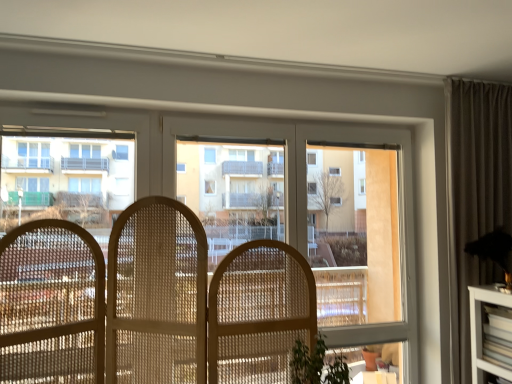
Where is `white glossy building at left`? The image size is (512, 384). white glossy building at left is located at coordinates (66, 179).

Does transparent glass window at center have a larger size compared to transparent glass bay window at center?

Yes.

Is the position of transparent glass window at center more distant than that of transparent glass bay window at center?

That is False.

Is transparent glass bay window at center a part of transparent glass window at center?

Yes.

Which is less distant, (x=285, y=234) or (x=47, y=200)?

Point (x=47, y=200)

Looking at this image, is transparent glass window at center outside of white glossy building at left?

transparent glass window at center is positioned outside white glossy building at left.

From the picture: Who is more distant, transparent glass window at center or white glossy building at left?

white glossy building at left is further from the camera.

Based on the photo, considering the relative sizes of transparent glass window at center and white glossy building at left in the image provided, is transparent glass window at center thinner than white glossy building at left?

Yes.

In terms of width, does transparent glass bay window at center look wider or thinner when compared to white glossy building at left?

Clearly, transparent glass bay window at center has less width compared to white glossy building at left.

Is the depth of transparent glass bay window at center less than that of white glossy building at left?

No, transparent glass bay window at center is behind white glossy building at left.

Is transparent glass bay window at center at the right side of white glossy building at left?

Correct, you'll find transparent glass bay window at center to the right of white glossy building at left.

Is transparent glass bay window at center looking in the opposite direction of white glossy building at left?

No, white glossy building at left is not at the back of transparent glass bay window at center.

From the image's perspective, is transparent glass bay window at center above or below transparent glass window at center?

Clearly, from the image's perspective, transparent glass bay window at center is above transparent glass window at center.

Is transparent glass window at center a part of transparent glass bay window at center?

That's incorrect, transparent glass window at center is not inside transparent glass bay window at center.

Are transparent glass bay window at center and transparent glass window at center located far from each other?

No, transparent glass bay window at center is in close proximity to transparent glass window at center.

From a real-world perspective, is transparent glass bay window at center positioned above or below transparent glass window at center?

From a real-world perspective, transparent glass bay window at center is physically above transparent glass window at center.

From the image's perspective, which is below, white glossy building at left or transparent glass window at center?

transparent glass window at center is shown below in the image.

Does white glossy building at left turn towards transparent glass window at center?

Yes, white glossy building at left is oriented towards transparent glass window at center.

Consider the image. From a real-world perspective, is white glossy building at left located beneath transparent glass window at center?

Incorrect, from a real-world perspective, white glossy building at left is higher than transparent glass window at center.

Considering the positions of point (13, 173) and point (303, 164), is point (13, 173) closer or farther from the camera than point (303, 164)?

Point (13, 173) is closer to the camera than point (303, 164).

Could you tell me if white glossy building at left is facing transparent glass bay window at center?

No, white glossy building at left does not turn towards transparent glass bay window at center.

From the picture: Can you confirm if white glossy building at left is taller than transparent glass bay window at center?

No, white glossy building at left is not taller than transparent glass bay window at center.

Is transparent glass bay window at center inside white glossy building at left?

Definitely not — transparent glass bay window at center is not inside white glossy building at left.

From the image's perspective, is white glossy building at left located above transparent glass bay window at center?

Yes, from the image's perspective, white glossy building at left is over transparent glass bay window at center.

At what (x,y) coordinates should I click in order to perform the action: click on window on the right of transparent glass bay window at center. Please return your answer as a coordinate pair (x, y). Image resolution: width=512 pixels, height=384 pixels. Looking at the image, I should click on (225, 140).

I want to click on condominium above the transparent glass window at center (from the image's perspective), so click(x=66, y=179).

From the image, which object appears to be nearer to white glossy building at left, transparent glass window at center or transparent glass bay window at center?

transparent glass window at center is positioned closer to the anchor white glossy building at left.

Looking at the image, which one is located further to white glossy building at left, transparent glass bay window at center or transparent glass window at center?

transparent glass bay window at center is positioned further to the anchor white glossy building at left.

Considering their positions, is white glossy building at left positioned closer to transparent glass window at center than transparent glass bay window at center?

white glossy building at left.

From the image, which object appears to be farther from transparent glass bay window at center, white glossy building at left or transparent glass window at center?

white glossy building at left is further to transparent glass bay window at center.

Looking at the image, which one is located further to transparent glass bay window at center, transparent glass window at center or white glossy building at left?

white glossy building at left lies further to transparent glass bay window at center than the other object.

From the image, which object appears to be farther from transparent glass window at center, transparent glass bay window at center or white glossy building at left?

The object further to transparent glass window at center is transparent glass bay window at center.

Identify the location of bay window between white glossy building at left and transparent glass window at center in the horizontal direction. The height and width of the screenshot is (384, 512). (232, 191).